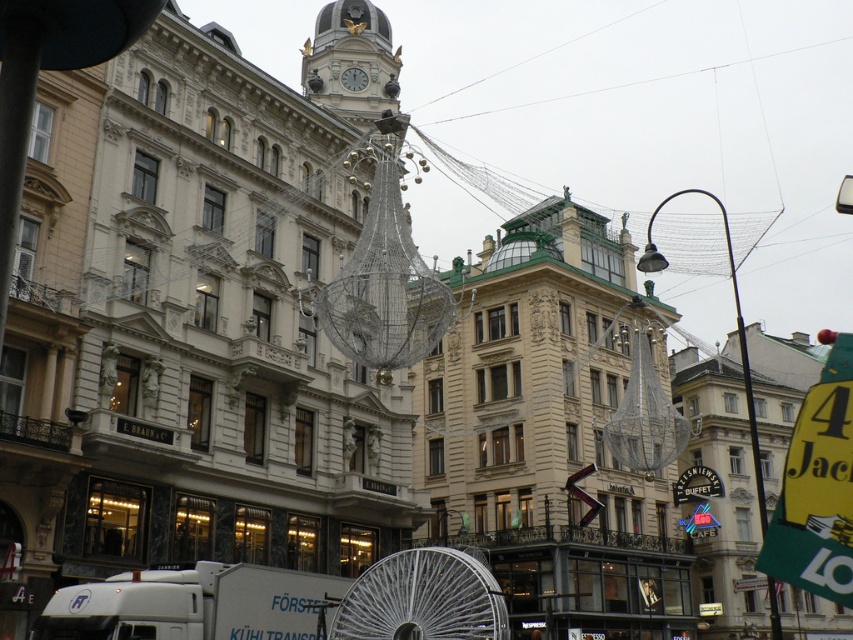
Question: Does gold ornate clock tower at upper center have a smaller size compared to silver metallic clock at upper center?

Choices:
 (A) yes
 (B) no

Answer: (B)

Question: Is gold ornate clock tower at upper center to the left of silver metallic clock at upper center from the viewer's perspective?

Choices:
 (A) yes
 (B) no

Answer: (A)

Question: Which point is farther to the camera?

Choices:
 (A) (850, 424)
 (B) (585, 621)
 (C) (338, 54)

Answer: (C)

Question: Which object is closer to the camera taking this photo?

Choices:
 (A) gold ornate clock tower at upper center
 (B) metallic pole at right
 (C) yellow paper sign at right
 (D) beige stone tower at center

Answer: (C)

Question: Does beige stone tower at center have a larger size compared to gold ornate clock tower at upper center?

Choices:
 (A) no
 (B) yes

Answer: (B)

Question: Which object is closer to the camera taking this photo?

Choices:
 (A) gold ornate clock tower at upper center
 (B) metallic pole at right
 (C) beige stone tower at center
 (D) yellow paper sign at right

Answer: (D)